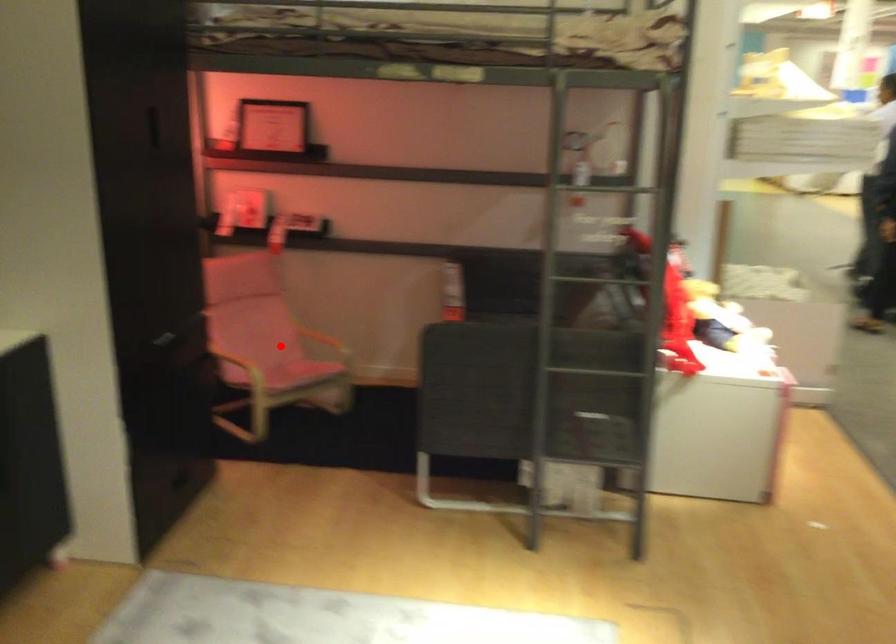
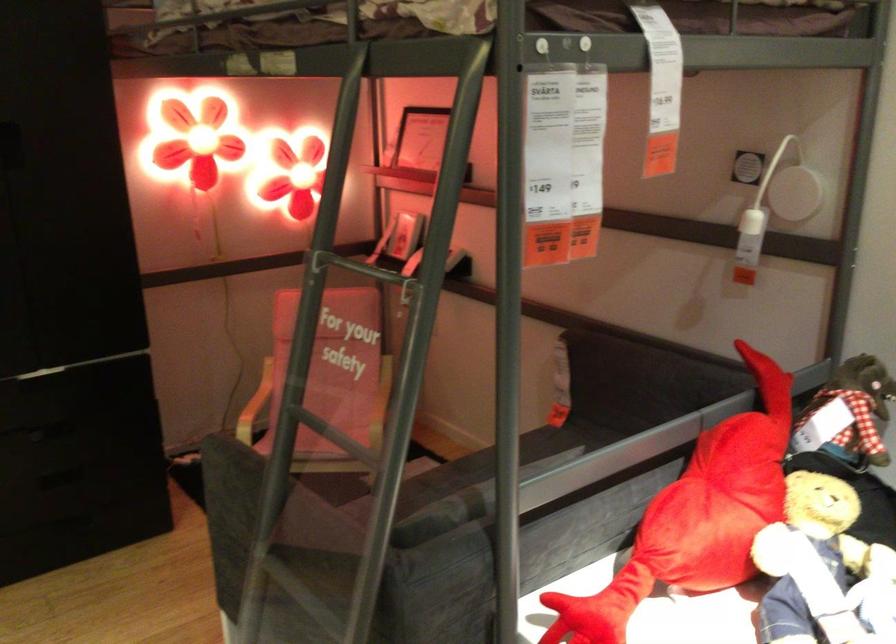
Question: I am providing you with two images of the same scene from different viewpoints. Image1 has a red point marked. In image2, the corresponding 3D location appears at what relative position? Reply with the corresponding letter.

Choices:
 (A) Closer
 (B) Farther

Answer: (A)